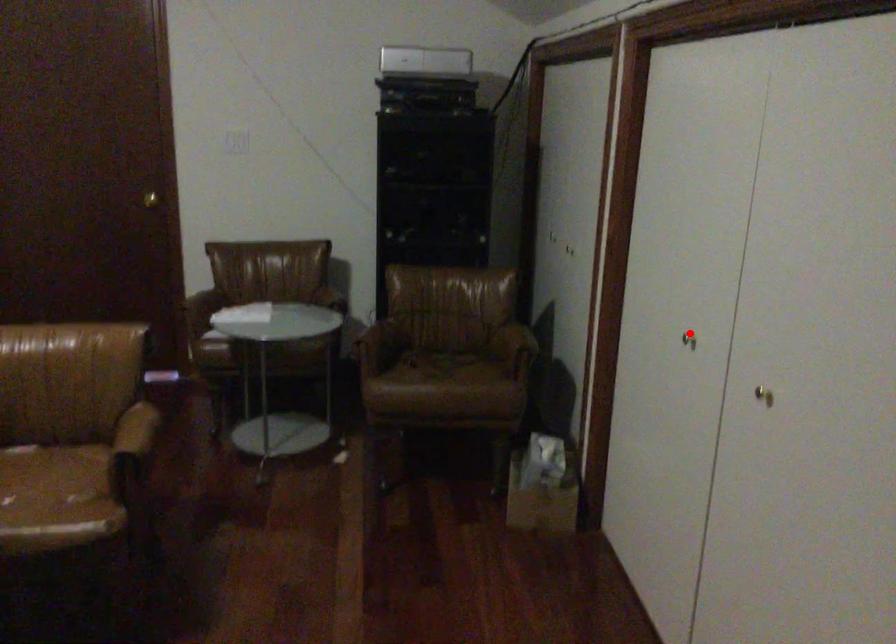
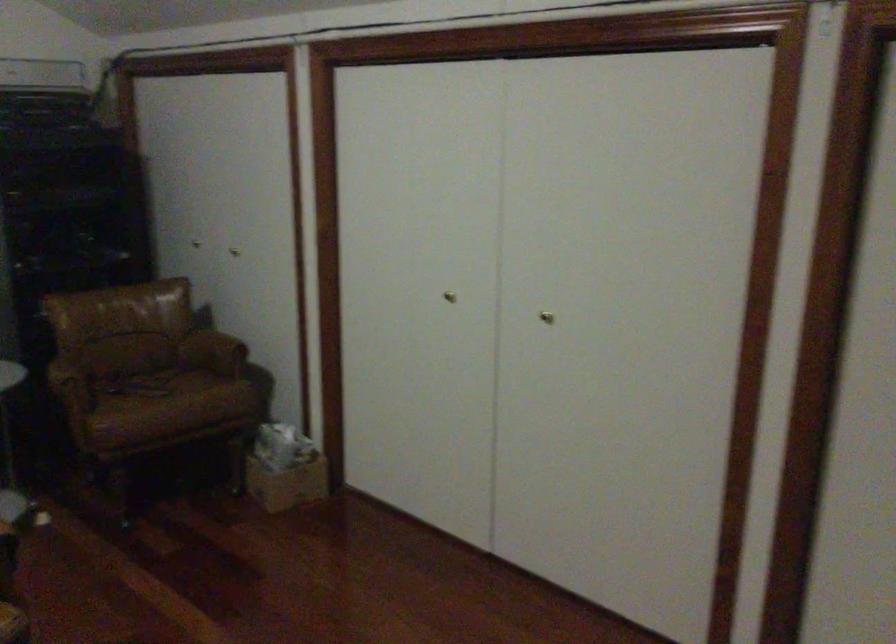
In the second image, find the point that corresponds to the highlighted location in the first image.

(449, 297)